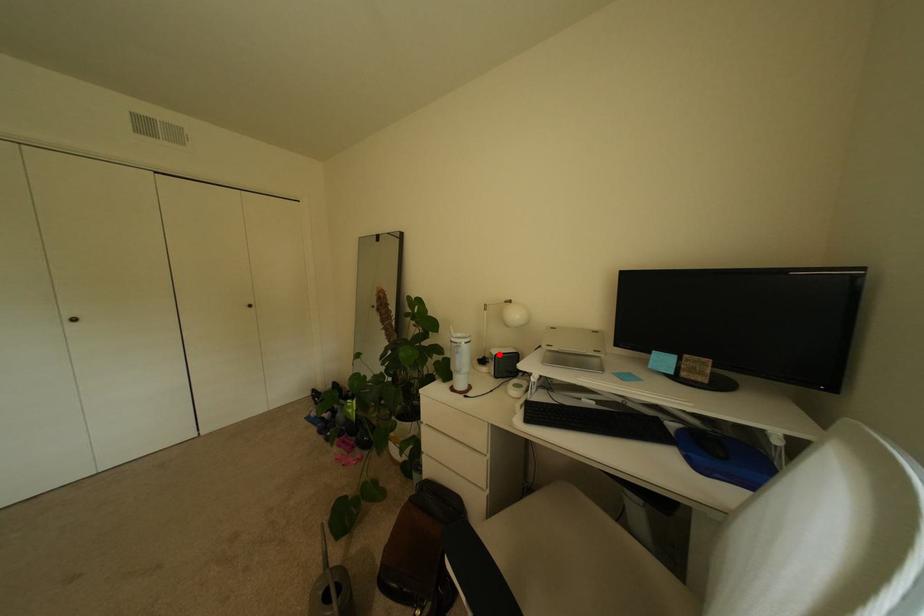
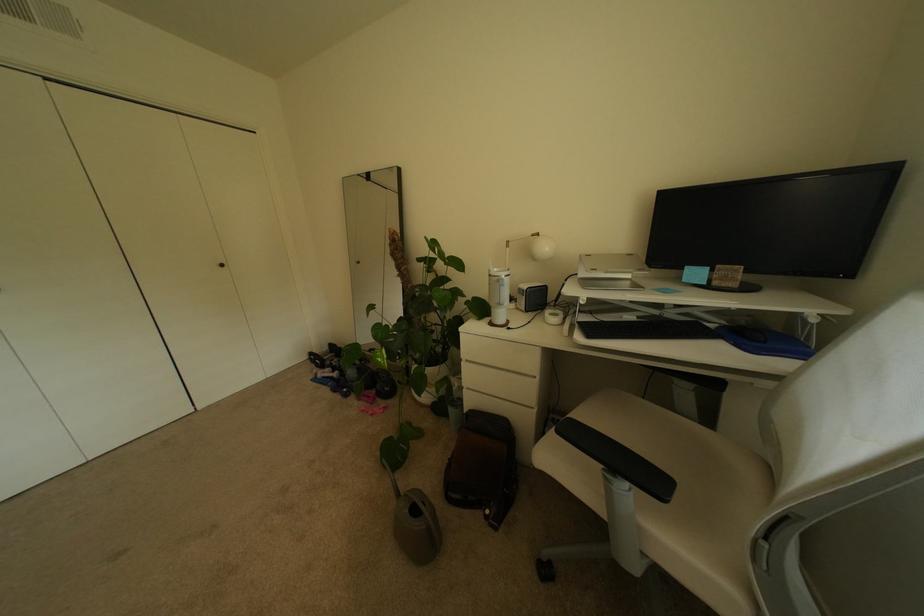
Find the pixel in the second image that matches the highlighted location in the first image.

(528, 290)